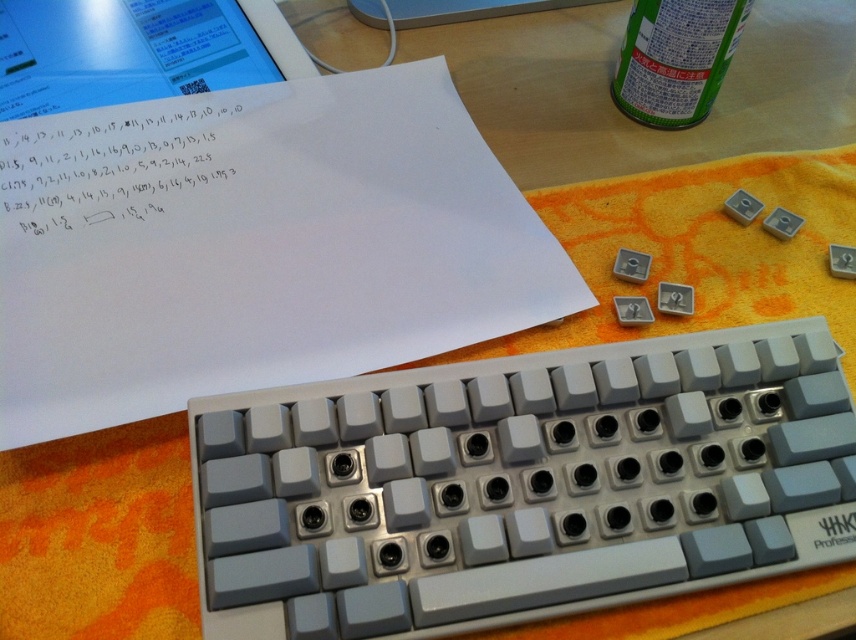
You have a small box that can only hold items narrower than the white plastic keyboard at center. Can the white paper at upper left fit into the box?

The white plastic keyboard at center is narrower than the white paper at upper left, so the white paper at upper left cannot fit into the box since it is wider than the keyboard.

You are a person with a height of 5 feet 6 inches. You are standing in front of the white plastic keyboard at center. Can you comfortably reach the keyboard without bending over? Please explain your reasoning based on the distance between you and the keyboard.

The distance between you and the white plastic keyboard at center is 13.31 inches. Since this distance is within a typical comfortable reach range for someone of your height, you can comfortably reach the keyboard without bending over.

From the picture: You are organizing your desk and want to place the white plastic keyboard at center closer to the paper. How much distance do you need to move it to align with the paper?

The white plastic keyboard at center is 13.31 inches away from the paper. To align them, you need to move the keyboard 13.31 inches toward the paper.